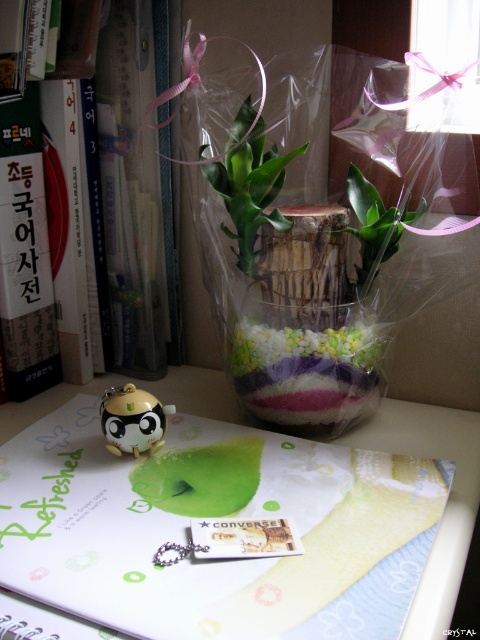
Question: Which point is closer to the camera taking this photo?

Choices:
 (A) pos(9,372)
 (B) pos(130,433)
 (C) pos(383,216)

Answer: (B)

Question: Is translucent plastic plant at center closer to the viewer compared to translucent plastic plant at upper center?

Choices:
 (A) no
 (B) yes

Answer: (B)

Question: Can you confirm if translucent plastic vase at center is positioned to the right of translucent plastic plant at center?

Choices:
 (A) no
 (B) yes

Answer: (B)

Question: Which object appears closest to the camera in this image?

Choices:
 (A) green matte notebook at center
 (B) matte yellow plastic panda at center
 (C) translucent plastic plant at center

Answer: (B)

Question: Which point is closer to the camera?

Choices:
 (A) (327, 406)
 (B) (51, 324)
 (C) (351, 196)

Answer: (A)

Question: Is green matte notebook at center thinner than translucent plastic plant at upper center?

Choices:
 (A) no
 (B) yes

Answer: (A)